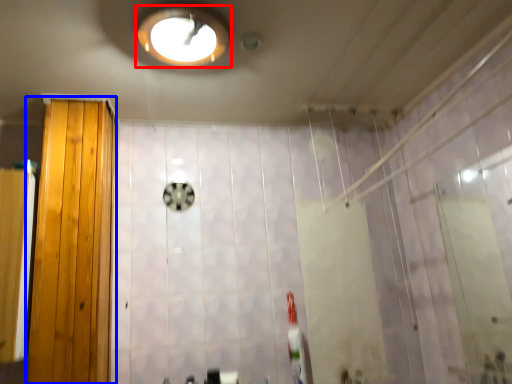
Question: Which object is further to the camera taking this photo, light fixture (highlighted by a red box) or door (highlighted by a blue box)?

Choices:
 (A) light fixture
 (B) door

Answer: (B)